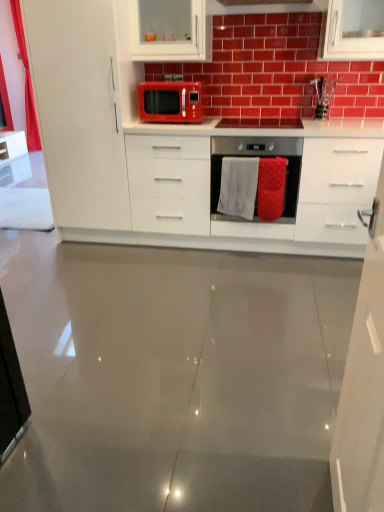
Question: Does white towel at center appear on the left side of white glossy cabinet at left, which is the third cabinetry in right-to-left order?

Choices:
 (A) yes
 (B) no

Answer: (B)

Question: Are white towel at center and white glossy cabinet at left, which is the third cabinetry in right-to-left order, far apart?

Choices:
 (A) yes
 (B) no

Answer: (A)

Question: Does white towel at center lie in front of white glossy cabinet at left, arranged as the second cabinetry when viewed from the front?

Choices:
 (A) yes
 (B) no

Answer: (B)

Question: Is white towel at center beside white glossy cabinet at left, which is the third cabinetry in right-to-left order?

Choices:
 (A) no
 (B) yes

Answer: (A)

Question: Is white towel at center positioned behind white glossy cabinet at left, positioned as the 1th cabinetry in left-to-right order?

Choices:
 (A) yes
 (B) no

Answer: (A)

Question: Is white glossy cabinet at left, which is the third cabinetry in right-to-left order, completely or partially inside white towel at center?

Choices:
 (A) no
 (B) yes

Answer: (A)

Question: Considering the relative sizes of white glossy countertop at center and white glossy cabinet at upper center, acting as the 3th cabinetry starting from the front, in the image provided, is white glossy countertop at center bigger than white glossy cabinet at upper center, acting as the 3th cabinetry starting from the front,?

Choices:
 (A) no
 (B) yes

Answer: (B)

Question: From a real-world perspective, is white glossy countertop at center positioned under white glossy cabinet at upper center, which appears as the second cabinetry when viewed from the right, based on gravity?

Choices:
 (A) no
 (B) yes

Answer: (B)

Question: Does white glossy countertop at center have a lesser width compared to white glossy cabinet at upper center, which ranks as the 1th cabinetry in back-to-front order?

Choices:
 (A) yes
 (B) no

Answer: (B)

Question: Is white glossy countertop at center positioned behind white glossy cabinet at upper center, which appears as the second cabinetry when viewed from the right?

Choices:
 (A) yes
 (B) no

Answer: (B)

Question: Is white glossy countertop at center far away from white glossy cabinet at upper center, which appears as the second cabinetry when viewed from the right?

Choices:
 (A) yes
 (B) no

Answer: (B)

Question: Does white glossy countertop at center contain white glossy cabinet at upper center, which ranks as the 1th cabinetry in back-to-front order?

Choices:
 (A) no
 (B) yes

Answer: (A)

Question: Considering the relative positions of white glossy cabinet at upper right, the 1th cabinetry when ordered from right to left, and red textured towel at center in the image provided, is white glossy cabinet at upper right, the 1th cabinetry when ordered from right to left, to the left of red textured towel at center from the viewer's perspective?

Choices:
 (A) yes
 (B) no

Answer: (A)